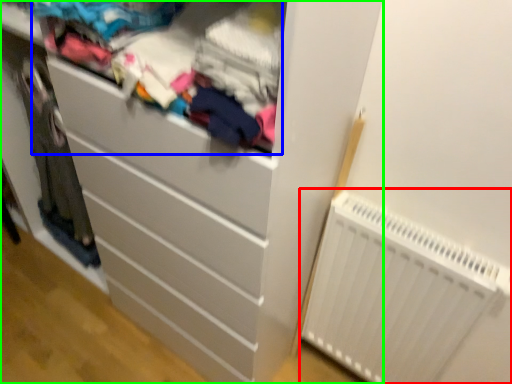
Question: Which is nearer to the radiator (highlighted by a red box)? clothing (highlighted by a blue box) or chest of drawers (highlighted by a green box).

Choices:
 (A) clothing
 (B) chest of drawers

Answer: (B)